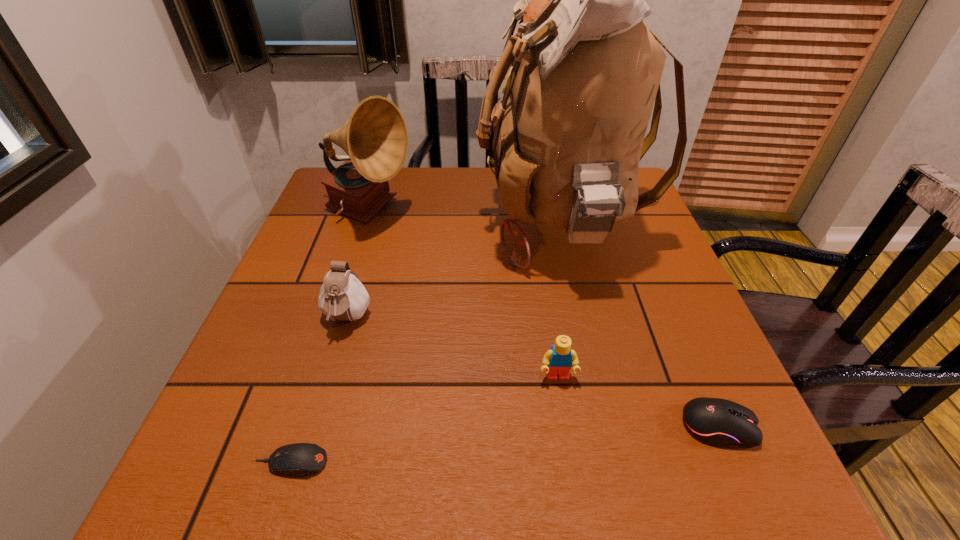
Where is `phonograph record that is at the left edge`? The height and width of the screenshot is (540, 960). phonograph record that is at the left edge is located at coordinates (375, 138).

This screenshot has width=960, height=540. Find the location of `pouch located at the left edge`. pouch located at the left edge is located at coordinates [x=342, y=296].

Locate an element on the screen. computer mouse present at the left edge is located at coordinates (300, 459).

Locate an element on the screen. The image size is (960, 540). backpack that is positioned at the right edge is located at coordinates (585, 71).

Locate an element on the screen. This screenshot has width=960, height=540. computer mouse located at the right edge is located at coordinates (719, 422).

Locate an element on the screen. object that is positioned at the far left corner is located at coordinates (375, 138).

Locate an element on the screen. object that is positioned at the near left corner is located at coordinates (300, 459).

Where is `object located at the far right corner`? This screenshot has width=960, height=540. object located at the far right corner is located at coordinates (585, 71).

Locate an element on the screen. The height and width of the screenshot is (540, 960). object present at the near right corner is located at coordinates (719, 422).

Where is `free space at the far edge of the desktop`? This screenshot has width=960, height=540. free space at the far edge of the desktop is located at coordinates (477, 166).